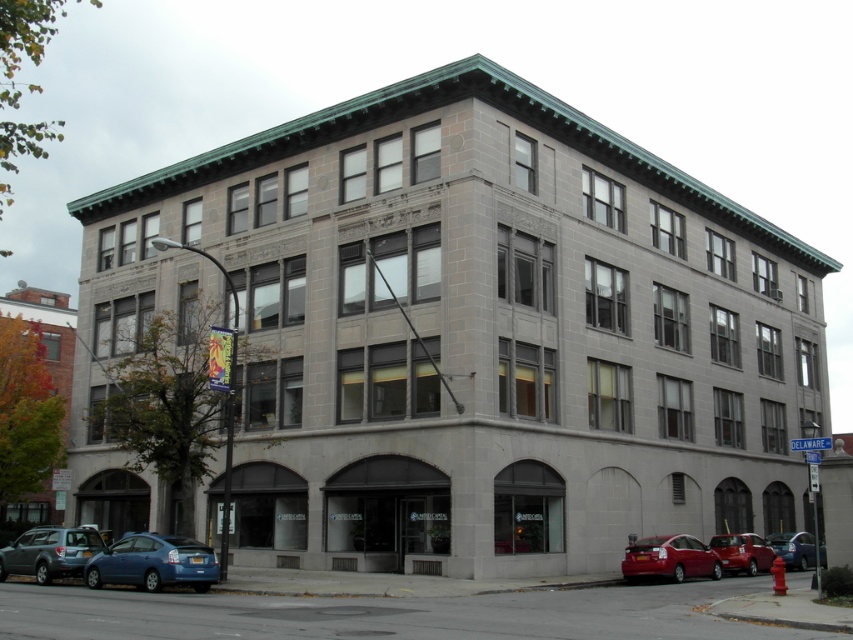
Based on the photo, between blue matte car at lower left and shiny red car at lower right, which one is positioned higher?

blue matte car at lower left is higher up.

Which is behind, point (202, 573) or point (729, 552)?

Positioned behind is point (729, 552).

Locate an element on the screen. blue matte car at lower left is located at coordinates (154, 563).

Does blue matte car at lower left appear over shiny red sedan at lower right?

Indeed, blue matte car at lower left is positioned over shiny red sedan at lower right.

Who is higher up, blue matte car at lower left or shiny red sedan at lower right?

blue matte car at lower left is above.

Between point (180, 538) and point (683, 548), which one is positioned behind?

The point (683, 548) is behind.

I want to click on blue matte car at lower left, so click(x=154, y=563).

Consider the image. Between matte gray suv at lower left and metallic silver sedan at lower right, which one appears on the left side from the viewer's perspective?

matte gray suv at lower left

Does point (10, 564) come closer to viewer compared to point (804, 548)?

That is True.

Is point (55, 554) positioned after point (802, 556)?

No, (55, 554) is closer to viewer.

Identify the location of matte gray suv at lower left. (49, 552).